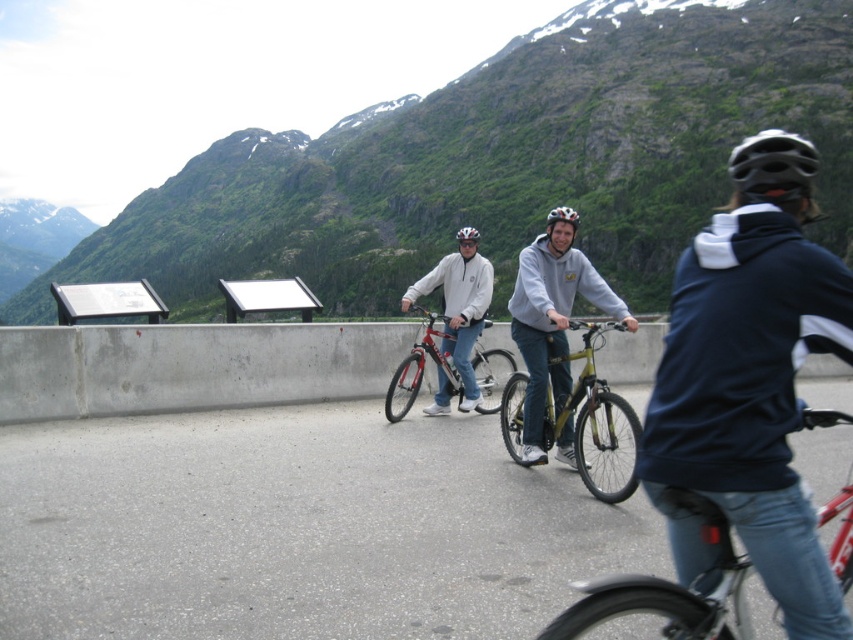
Question: Among these points, which one is nearest to the camera?

Choices:
 (A) (430, 333)
 (B) (614, 397)
 (C) (550, 216)

Answer: (B)

Question: Considering the real-world distances, which object is farthest from the dark blue hoodie at right?

Choices:
 (A) white matte bicycle helmet at center
 (B) black matte helmet at center
 (C) shiny metallic bicycle at center

Answer: (A)

Question: Is green matte bicycle at center positioned behind black matte helmet at center?

Choices:
 (A) yes
 (B) no

Answer: (B)

Question: Does shiny metallic bicycle at center lie in front of black matte helmet at center?

Choices:
 (A) no
 (B) yes

Answer: (A)

Question: Does shiny silver bicycle at center have a smaller size compared to white matte bicycle helmet at center?

Choices:
 (A) yes
 (B) no

Answer: (A)

Question: Based on their relative distances, which object is farther from the shiny black helmet at upper right?

Choices:
 (A) green grassy mountain at upper center
 (B) black matte helmet at center
 (C) white matte bicycle helmet at center

Answer: (A)